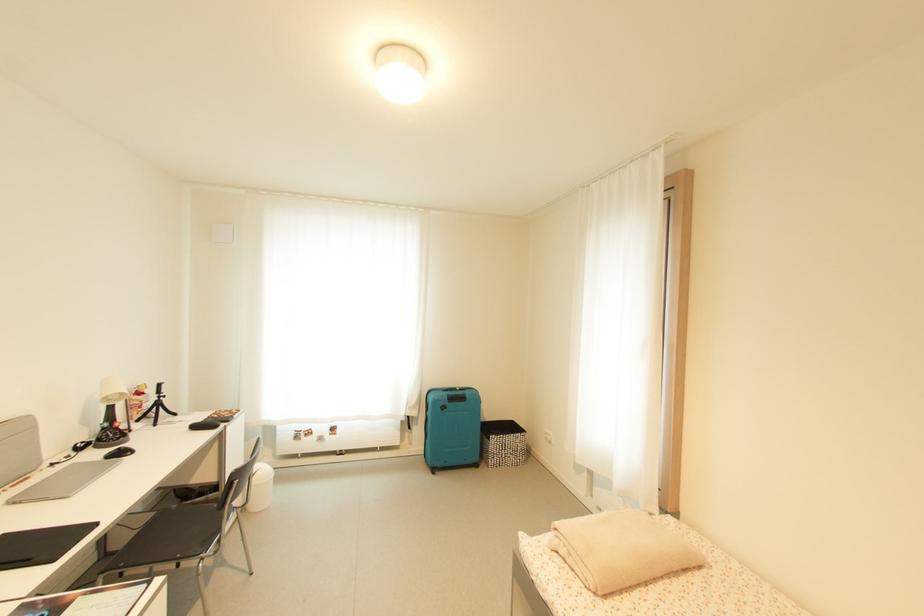
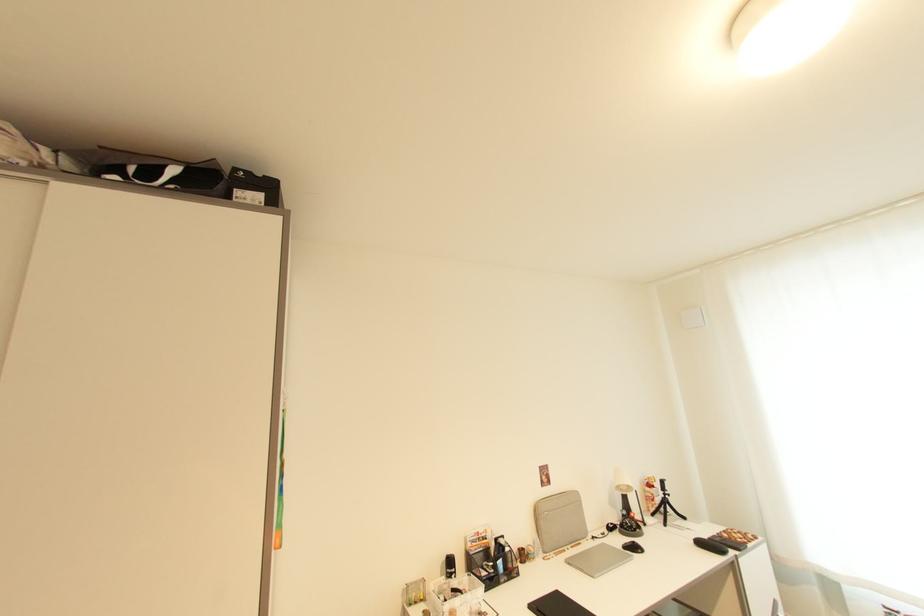
The point at (x=120, y=399) is marked in the first image. Where is the corresponding point in the second image?

(629, 490)